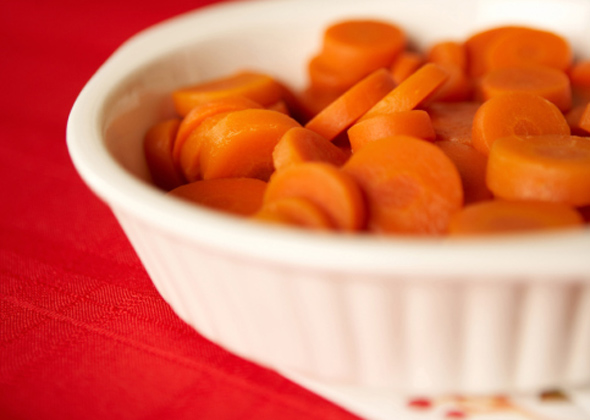
Identify the location of white bowl. (299, 273), (262, 41), (452, 11), (576, 20), (98, 164).